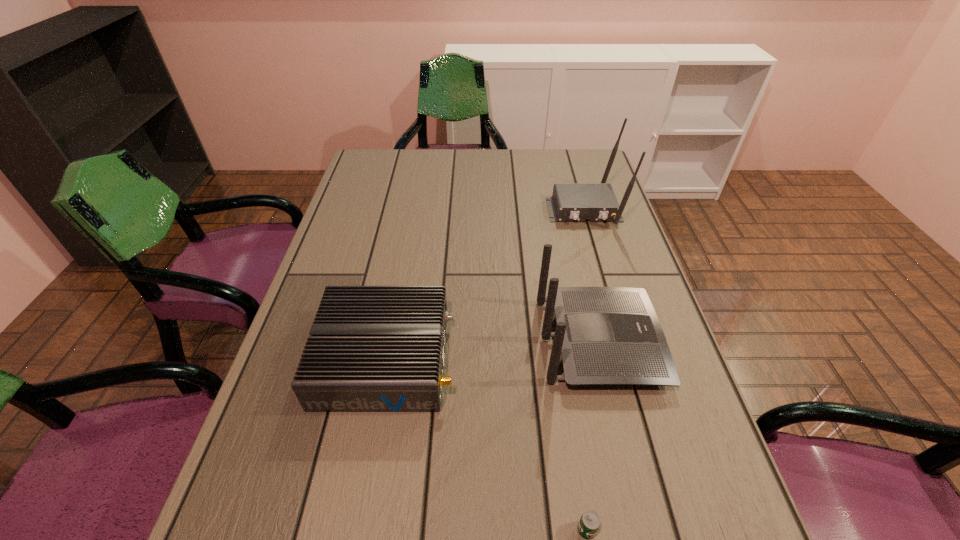
This screenshot has height=540, width=960. I want to click on the farthest router, so click(x=571, y=202).

Where is `the farthest object`? The height and width of the screenshot is (540, 960). the farthest object is located at coordinates pos(571,202).

Find the location of `the third shortest object`. the third shortest object is located at coordinates (606, 335).

The image size is (960, 540). I want to click on the shortest router, so pyautogui.click(x=372, y=348).

The height and width of the screenshot is (540, 960). Identify the location of the leftmost object. (372, 348).

Find the location of a particular element. The height and width of the screenshot is (540, 960). vacant space located on the back of the farthest router to connect cables is located at coordinates (602, 273).

I want to click on vacant space situated on the back panel of the leftmost object, so click(630, 358).

Identify the location of object that is at the left edge. The height and width of the screenshot is (540, 960). (372, 348).

You are a GUI agent. You are given a task and a screenshot of the screen. Output one action in this format:
    pyautogui.click(x=<x>, y=<y>)
    Task: Click on the free space at the far edge
    The height and width of the screenshot is (540, 960).
    Given the screenshot: What is the action you would take?
    pyautogui.click(x=468, y=162)

In the image, there is a desktop. Identify the location of free space at the left edge. tap(353, 228).